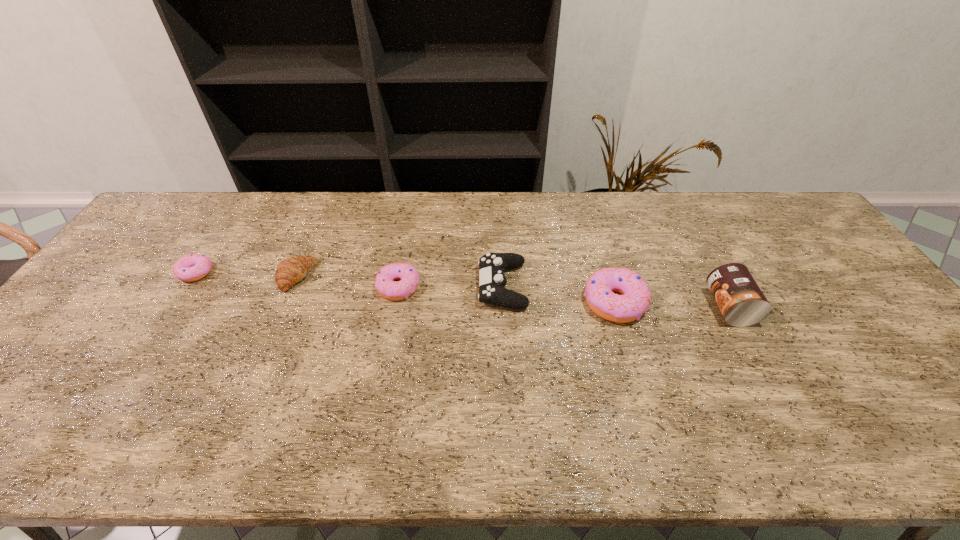
Please point a spot on the right to add another doughnut. Please provide its 2D coordinates. Your answer should be formatted as a tuple, i.e. [(x, y)], where the tuple contains the x and y coordinates of a point satisfying the conditions above.

[(846, 318)]